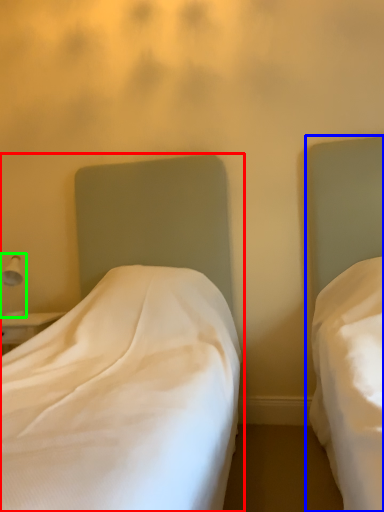
Question: Based on their relative distances, which object is farther from bed (highlighted by a red box)? Choose from bed (highlighted by a blue box) and bedside lamp (highlighted by a green box).

Choices:
 (A) bed
 (B) bedside lamp

Answer: (B)